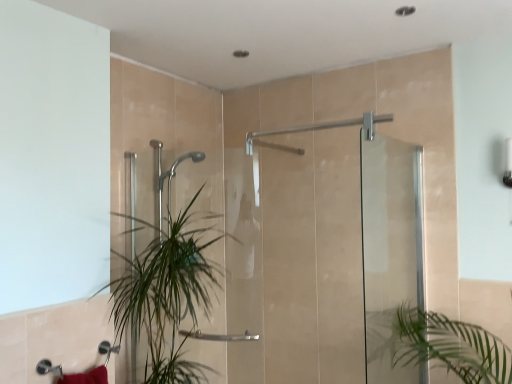
Where is `transparent glass screen door at right, which is counted as the second screen door, starting from the left`? This screenshot has height=384, width=512. transparent glass screen door at right, which is counted as the second screen door, starting from the left is located at coordinates (390, 249).

The width and height of the screenshot is (512, 384). Find the location of `clear glass shower door at center, the first screen door when ordered from left to right`. clear glass shower door at center, the first screen door when ordered from left to right is located at coordinates (384, 240).

Is transparent glass screen door at right, the 1th screen door in the right-to-left sequence, not near clear glass shower door at center, which ranks as the second screen door in right-to-left order?

No, there isn't a large distance between transparent glass screen door at right, the 1th screen door in the right-to-left sequence, and clear glass shower door at center, which ranks as the second screen door in right-to-left order.

Is transparent glass screen door at right, the 1th screen door in the right-to-left sequence, facing towards clear glass shower door at center, which ranks as the second screen door in right-to-left order?

No, transparent glass screen door at right, the 1th screen door in the right-to-left sequence, is not facing towards clear glass shower door at center, which ranks as the second screen door in right-to-left order.

From the picture: Measure the distance from clear glass shower door at center, which ranks as the second screen door in right-to-left order, to green leafy plant at center.

clear glass shower door at center, which ranks as the second screen door in right-to-left order, and green leafy plant at center are 3.34 feet apart.

Is the surface of clear glass shower door at center, the first screen door when ordered from left to right, in direct contact with green leafy plant at center?

No, clear glass shower door at center, the first screen door when ordered from left to right, is not in contact with green leafy plant at center.

From a real-world perspective, starting from the green leafy plant at center, which screen door is the 2nd one vertically above it? Please provide its 2D coordinates.

[(384, 240)]

Is clear glass shower door at center, the first screen door when ordered from left to right, facing towards green leafy plant at center?

Yes, clear glass shower door at center, the first screen door when ordered from left to right, is aimed at green leafy plant at center.

Which of these two, transparent glass screen door at right, which is counted as the second screen door, starting from the left, or green leafy plant at center, is smaller?

Smaller between the two is transparent glass screen door at right, which is counted as the second screen door, starting from the left.

Does transparent glass screen door at right, which is counted as the second screen door, starting from the left, have a lesser height compared to green leafy plant at center?

No.

From the image's perspective, is transparent glass screen door at right, the 1th screen door in the right-to-left sequence, located above green leafy plant at center?

Indeed, from the image's perspective, transparent glass screen door at right, the 1th screen door in the right-to-left sequence, is shown above green leafy plant at center.

Is transparent glass screen door at right, which is counted as the second screen door, starting from the left, turned away from green leafy plant at center?

That's right, transparent glass screen door at right, which is counted as the second screen door, starting from the left, is facing away from green leafy plant at center.

Is green leafy plant at center inside or outside of clear glass shower door at center, the first screen door when ordered from left to right?

green leafy plant at center cannot be found inside clear glass shower door at center, the first screen door when ordered from left to right.

How different are the orientations of green leafy plant at center and clear glass shower door at center, which ranks as the second screen door in right-to-left order, in degrees?

The angular difference between green leafy plant at center and clear glass shower door at center, which ranks as the second screen door in right-to-left order, is 85.4 degrees.

Is green leafy plant at center facing away from clear glass shower door at center, which ranks as the second screen door in right-to-left order?

No, green leafy plant at center's orientation is not away from clear glass shower door at center, which ranks as the second screen door in right-to-left order.

Does point (160, 273) appear closer or farther from the camera than point (375, 139)?

Clearly, point (160, 273) is closer to the camera than point (375, 139).

Which of these two, clear glass shower door at center, the first screen door when ordered from left to right, or transparent glass screen door at right, which is counted as the second screen door, starting from the left, stands taller?

transparent glass screen door at right, which is counted as the second screen door, starting from the left.

Is clear glass shower door at center, the first screen door when ordered from left to right, turned away from transparent glass screen door at right, the 1th screen door in the right-to-left sequence?

Yes.

How distant is clear glass shower door at center, which ranks as the second screen door in right-to-left order, from transparent glass screen door at right, which is counted as the second screen door, starting from the left?

A distance of 0.51 inches exists between clear glass shower door at center, which ranks as the second screen door in right-to-left order, and transparent glass screen door at right, which is counted as the second screen door, starting from the left.

Considering the relative sizes of clear glass shower door at center, which ranks as the second screen door in right-to-left order, and transparent glass screen door at right, the 1th screen door in the right-to-left sequence, in the image provided, is clear glass shower door at center, which ranks as the second screen door in right-to-left order, thinner than transparent glass screen door at right, the 1th screen door in the right-to-left sequence,?

In fact, clear glass shower door at center, which ranks as the second screen door in right-to-left order, might be wider than transparent glass screen door at right, the 1th screen door in the right-to-left sequence.

Which is more distant, (x=172, y=341) or (x=392, y=352)?

Point (x=392, y=352)

In the scene shown: In the image, is green leafy plant at center positioned in front of or behind transparent glass screen door at right, which is counted as the second screen door, starting from the left?

In the image, green leafy plant at center appears behind transparent glass screen door at right, which is counted as the second screen door, starting from the left.

Is green leafy plant at center bigger or smaller than transparent glass screen door at right, which is counted as the second screen door, starting from the left?

In the image, green leafy plant at center appears to be larger than transparent glass screen door at right, which is counted as the second screen door, starting from the left.

This screenshot has width=512, height=384. I want to click on screen door above the transparent glass screen door at right, the 1th screen door in the right-to-left sequence (from the image's perspective), so click(384, 240).

Locate an element on the screen. The height and width of the screenshot is (384, 512). houseplant below the clear glass shower door at center, the first screen door when ordered from left to right (from the image's perspective) is located at coordinates (167, 297).

Considering their positions, is clear glass shower door at center, the first screen door when ordered from left to right, positioned closer to green leafy plant at center than transparent glass screen door at right, the 1th screen door in the right-to-left sequence?

clear glass shower door at center, the first screen door when ordered from left to right, is positioned closer to the anchor green leafy plant at center.

Estimate the real-world distances between objects in this image. Which object is closer to green leafy plant at center, transparent glass screen door at right, the 1th screen door in the right-to-left sequence, or clear glass shower door at center, the first screen door when ordered from left to right?

clear glass shower door at center, the first screen door when ordered from left to right, lies closer to green leafy plant at center than the other object.

Which object lies nearer to the anchor point clear glass shower door at center, the first screen door when ordered from left to right, transparent glass screen door at right, which is counted as the second screen door, starting from the left, or green leafy plant at center?

The object closer to clear glass shower door at center, the first screen door when ordered from left to right, is transparent glass screen door at right, which is counted as the second screen door, starting from the left.

When comparing their distances from transparent glass screen door at right, the 1th screen door in the right-to-left sequence, does green leafy plant at center or clear glass shower door at center, the first screen door when ordered from left to right, seem further?

green leafy plant at center is further to transparent glass screen door at right, the 1th screen door in the right-to-left sequence.

Looking at the image, which one is located closer to clear glass shower door at center, the first screen door when ordered from left to right, green leafy plant at center or transparent glass screen door at right, the 1th screen door in the right-to-left sequence?

Among the two, transparent glass screen door at right, the 1th screen door in the right-to-left sequence, is located nearer to clear glass shower door at center, the first screen door when ordered from left to right.

Estimate the real-world distances between objects in this image. Which object is closer to transparent glass screen door at right, which is counted as the second screen door, starting from the left, clear glass shower door at center, which ranks as the second screen door in right-to-left order, or green leafy plant at center?

clear glass shower door at center, which ranks as the second screen door in right-to-left order, is positioned closer to the anchor transparent glass screen door at right, which is counted as the second screen door, starting from the left.

Image resolution: width=512 pixels, height=384 pixels. Identify the location of screen door between green leafy plant at center and transparent glass screen door at right, which is counted as the second screen door, starting from the left. point(384,240).